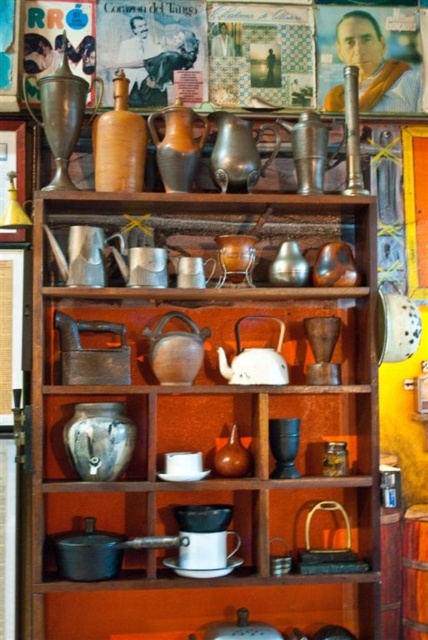
You are trying to fit a new item between the shiny silver teapot at center and the brushed metal tea pot at left. Which teapot should you place closer to the edge to make more space?

To make more space between the shiny silver teapot at center and the brushed metal tea pot at left, you should move the brushed metal tea pot at left closer to the edge since it is wider than the shiny silver teapot at center.

You are arranging items on a shelf and see the shiny silver teapot at center and the brushed metal tea pot at left. Which one is positioned more to the right?

The shiny silver teapot at center is positioned more to the right than the brushed metal tea pot at left.

In the scene shown: You are a delivery person who needs to place a new teapot that is 17 inches wide onto the shelf. You see the matte ceramic teapot at center and the white matte teapot at center. Can you fit the new teapot between them?

The matte ceramic teapot at center and white matte teapot at center are 16.93 inches apart from each other. Since the new teapot is 17 inches wide, there is not enough space to fit it between them.